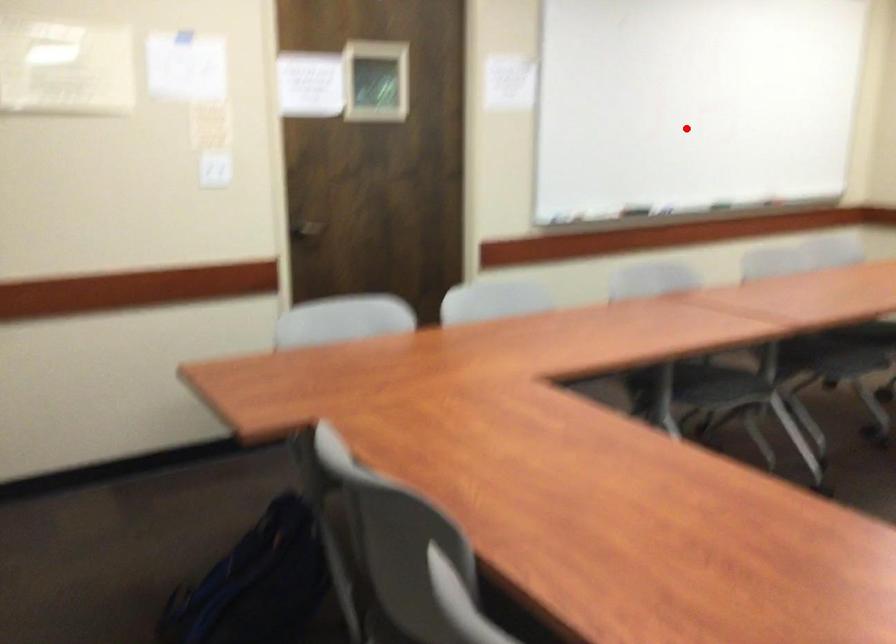
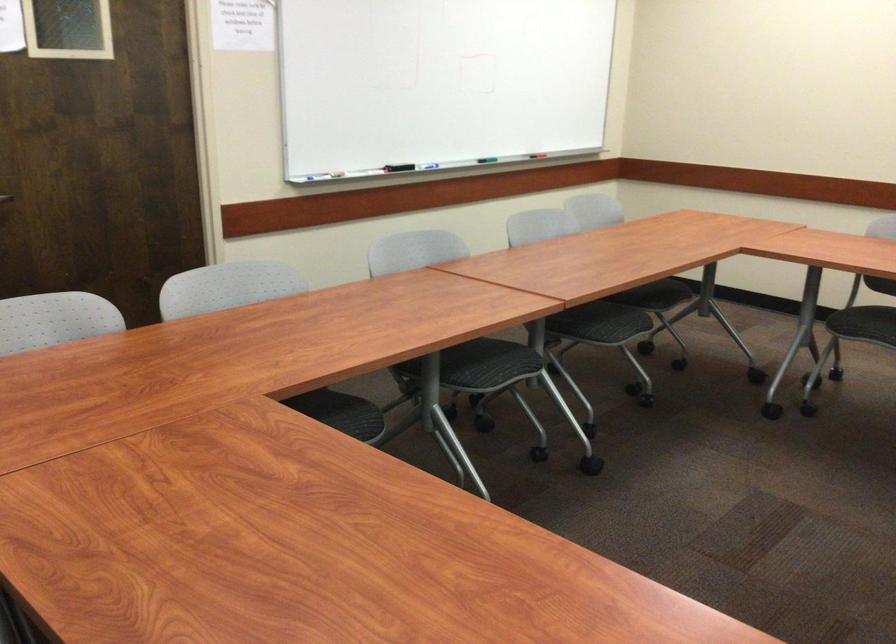
Question: I am providing you with two images of the same scene from different viewpoints. A red point is marked on the first image. At the location where the point appears in image 1, is it still visible in image 2?

Choices:
 (A) Yes
 (B) No

Answer: (A)